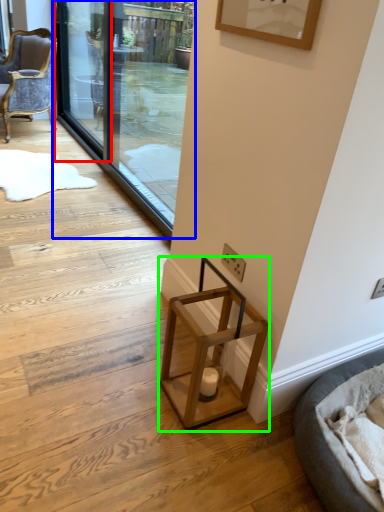
Question: Which object is the farthest from screen door (highlighted by a red box)? Choose among these: screen door (highlighted by a blue box) or stool (highlighted by a green box).

Choices:
 (A) screen door
 (B) stool

Answer: (B)